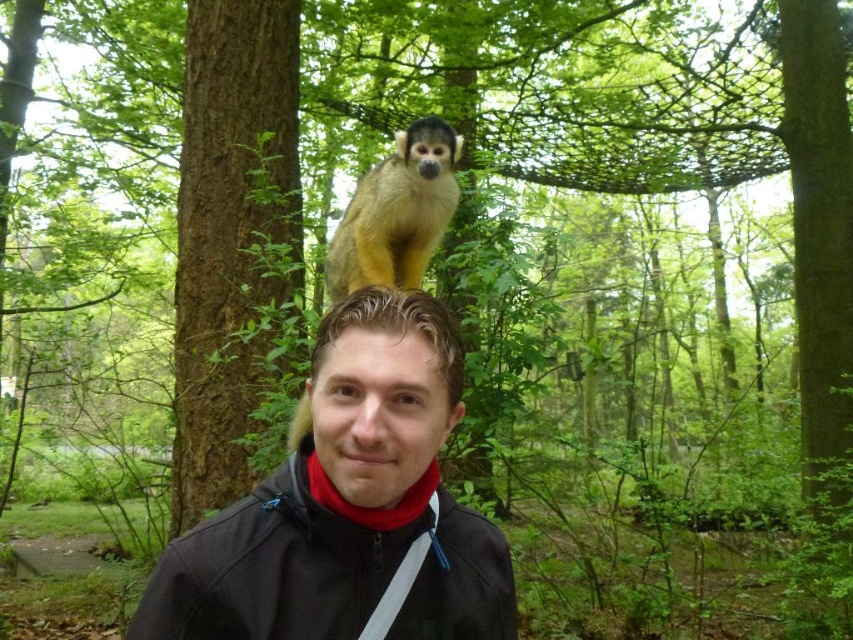
Question: Is matte black jacket at center bigger than matte black head at center?

Choices:
 (A) no
 (B) yes

Answer: (B)

Question: Which object appears farthest from the camera in this image?

Choices:
 (A) matte black head at center
 (B) golden fur monkey at upper center

Answer: (B)

Question: Is matte black jacket at center to the left of matte black head at center from the viewer's perspective?

Choices:
 (A) no
 (B) yes

Answer: (A)

Question: Which of the following is the farthest from the observer?

Choices:
 (A) (x=410, y=392)
 (B) (x=415, y=273)
 (C) (x=386, y=371)

Answer: (B)

Question: Which point is farther to the camera?

Choices:
 (A) matte black jacket at center
 (B) matte black head at center
 (C) golden fur monkey at upper center

Answer: (C)

Question: Is matte black jacket at center positioned at the back of golden fur monkey at upper center?

Choices:
 (A) no
 (B) yes

Answer: (A)